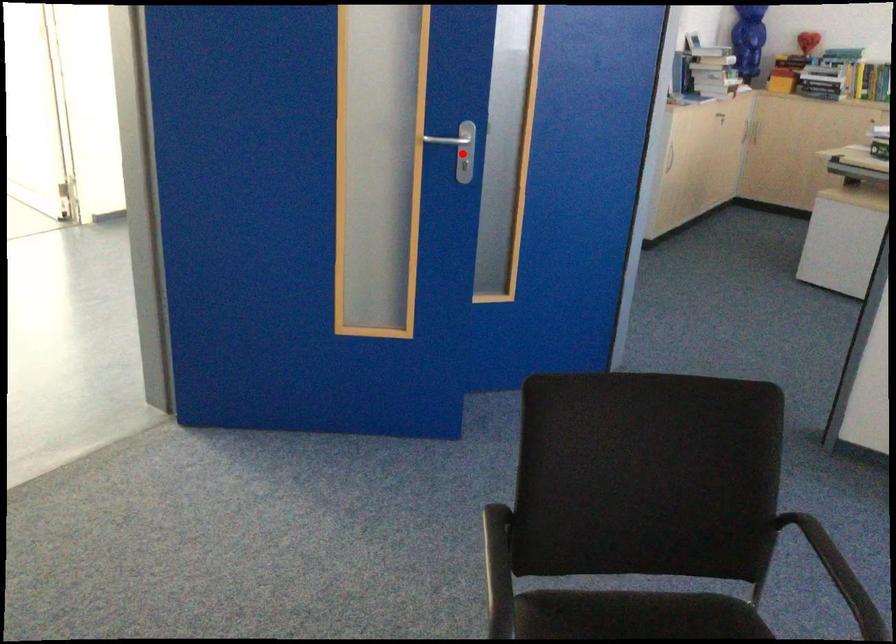
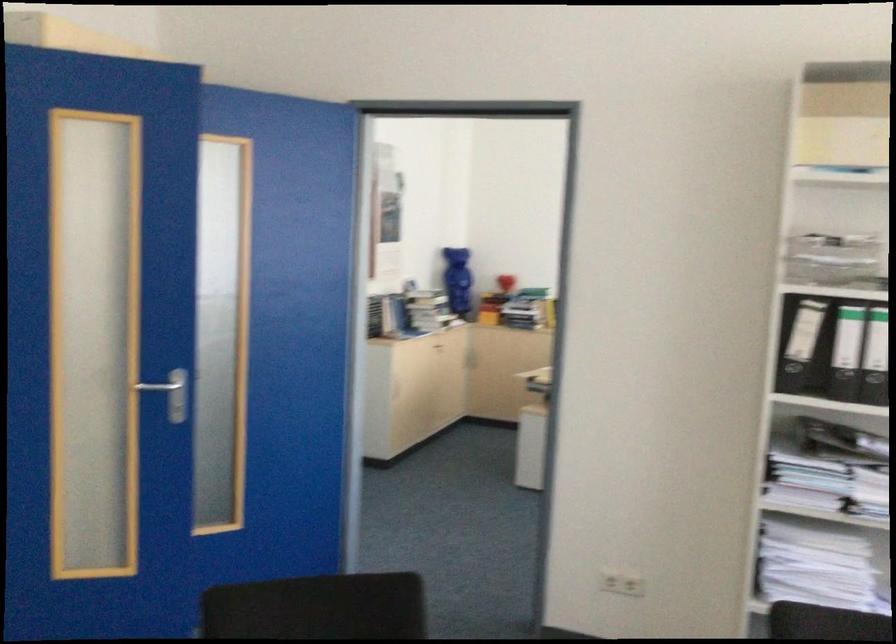
Question: A red point is marked in image1. In image2, is the corresponding 3D point closer to the camera or farther? Reply with the corresponding letter.

Choices:
 (A) The corresponding 3D point is closer.
 (B) The corresponding 3D point is farther.

Answer: (B)